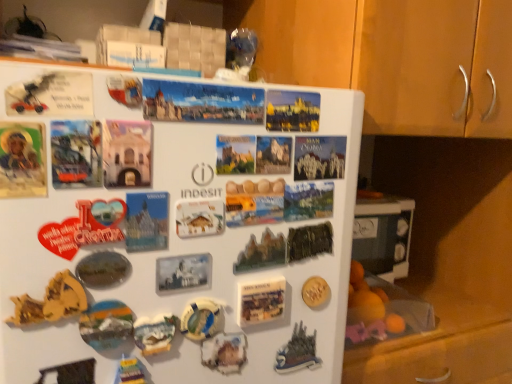
Question: Can you confirm if metallic silver magnet at lower left, which is the 3th art from left to right, is bigger than matte plastic postcard at upper center, which is the 4th postcard from bottom to top?

Choices:
 (A) no
 (B) yes

Answer: (A)

Question: Does metallic silver magnet at lower left, which is the 3th art from left to right, lie behind matte plastic postcard at upper center, which is the 4th postcard from bottom to top?

Choices:
 (A) yes
 (B) no

Answer: (A)

Question: Considering the relative sizes of metallic silver magnet at lower left, which is the 3th art from left to right, and matte plastic postcard at upper center, which is the 4th postcard from bottom to top, in the image provided, is metallic silver magnet at lower left, which is the 3th art from left to right, smaller than matte plastic postcard at upper center, which is the 4th postcard from bottom to top,?

Choices:
 (A) yes
 (B) no

Answer: (A)

Question: Is metallic silver magnet at lower left, which is the 3th art from left to right, far away from matte plastic postcard at upper center, which appears as the 1th postcard when viewed from the top?

Choices:
 (A) yes
 (B) no

Answer: (B)

Question: Is metallic silver magnet at lower left, which is the 3th art from left to right, taller than matte plastic postcard at upper center, which appears as the 1th postcard when viewed from the top?

Choices:
 (A) no
 (B) yes

Answer: (B)

Question: From a real-world perspective, relative to matte plastic magnet at center, acting as the 6th art starting from the left, is metallic gold leaf at upper right, which appears as the second art when viewed from the right, vertically above or below?

Choices:
 (A) below
 (B) above

Answer: (B)

Question: Is metallic gold leaf at upper right, arranged as the ninth art when viewed from the left, bigger or smaller than matte plastic magnet at center, which is counted as the 5th art, starting from the right?

Choices:
 (A) small
 (B) big

Answer: (B)

Question: Does point (309, 228) appear closer or farther from the camera than point (245, 342)?

Choices:
 (A) farther
 (B) closer

Answer: (A)

Question: Visually, is metallic gold leaf at upper right, which appears as the second art when viewed from the right, positioned to the left or to the right of matte plastic magnet at center, which is counted as the 5th art, starting from the right?

Choices:
 (A) left
 (B) right

Answer: (B)

Question: Based on their sizes in the image, would you say matte plastic magnet at lower center, which is the 7th art in right-to-left order, is bigger or smaller than green matte magnet at center, placed as the 4th art when sorted from right to left?

Choices:
 (A) big
 (B) small

Answer: (B)

Question: Is matte plastic magnet at lower center, the 4th art positioned from the left, situated inside green matte magnet at center, placed as the 4th art when sorted from right to left, or outside?

Choices:
 (A) outside
 (B) inside

Answer: (A)

Question: Does point (138, 329) appear closer or farther from the camera than point (252, 268)?

Choices:
 (A) closer
 (B) farther

Answer: (A)

Question: Considering their positions, is matte plastic magnet at lower center, the 4th art positioned from the left, located in front of or behind green matte magnet at center, arranged as the 7th art when viewed from the left?

Choices:
 (A) behind
 (B) front

Answer: (B)

Question: Does point (263, 314) appear closer or farther from the camera than point (301, 354)?

Choices:
 (A) closer
 (B) farther

Answer: (A)

Question: In terms of height, does matte plastic postcard at center, which ranks as the fourth postcard in top-to-bottom order, look taller or shorter compared to metallic silver castle at lower right, which appears as the 3th art when viewed from the right?

Choices:
 (A) tall
 (B) short

Answer: (B)